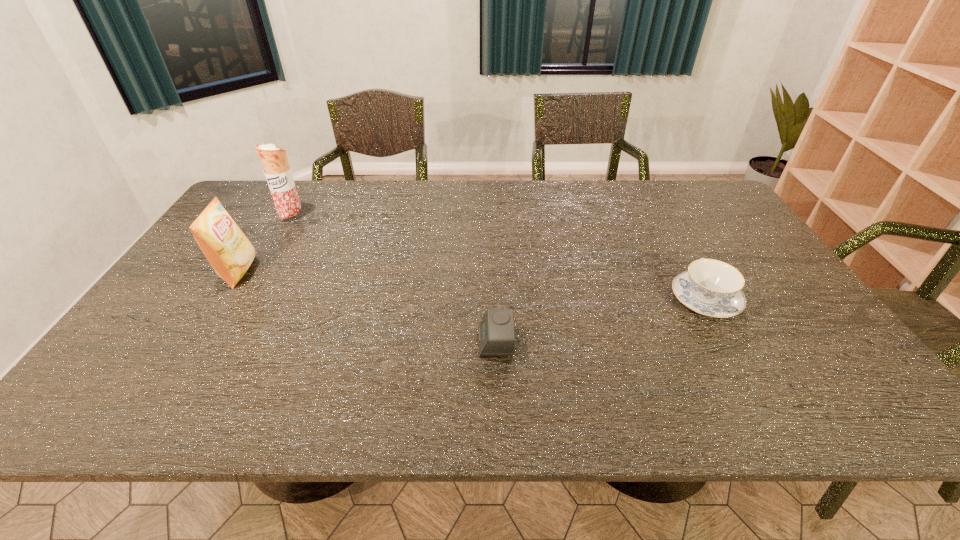
Locate an element on the screen. free space between the nearest object and the third shortest object is located at coordinates (367, 307).

At what (x,y) coordinates should I click in order to perform the action: click on vacant space that is in between the shortest object and the third shortest object. Please return your answer as a coordinate pair (x, y). The image size is (960, 540). Looking at the image, I should click on (367, 307).

Find the location of `vacant space in between the rightmost object and the second tallest object`. vacant space in between the rightmost object and the second tallest object is located at coordinates (x=471, y=286).

Select which object appears as the third closest to the burrito. Please provide its 2D coordinates. Your answer should be formatted as a tuple, i.e. [(x, y)], where the tuple contains the x and y coordinates of a point satisfying the conditions above.

[(710, 287)]

Find the location of a particular element. The width and height of the screenshot is (960, 540). object that is the closest to the second object from right to left is located at coordinates (710, 287).

Image resolution: width=960 pixels, height=540 pixels. What are the coordinates of `free space that satisfies the following two spatial constraints: 1. on the front-facing side of the crisp (potato chip); 2. with the handle on the side of the chinaware` in the screenshot? It's located at (222, 299).

You are a GUI agent. You are given a task and a screenshot of the screen. Output one action in this format:
    pyautogui.click(x=<x>, y=<y>)
    Task: Click on the vacant space that satisfies the following two spatial constraints: 1. on the front-facing side of the crisp (potato chip); 2. with the handle on the side of the rightmost object
    The height and width of the screenshot is (540, 960).
    Given the screenshot: What is the action you would take?
    pyautogui.click(x=222, y=299)

You are a GUI agent. You are given a task and a screenshot of the screen. Output one action in this format:
    pyautogui.click(x=<x>, y=<y>)
    Task: Click on the vacant point that satisfies the following two spatial constraints: 1. with the handle on the side of the chinaware; 2. on the front-facing side of the crisp (potato chip)
    
    Given the screenshot: What is the action you would take?
    pyautogui.click(x=689, y=272)

You are a GUI agent. You are given a task and a screenshot of the screen. Output one action in this format:
    pyautogui.click(x=<x>, y=<y>)
    Task: Click on the free space that satisfies the following two spatial constraints: 1. on the front-facing side of the crisp (potato chip); 2. with the handle on the side of the rightmost object
    The height and width of the screenshot is (540, 960).
    Given the screenshot: What is the action you would take?
    [222, 299]

This screenshot has width=960, height=540. Identify the location of vacant space that satisfies the following two spatial constraints: 1. with the handle on the side of the second shortest object; 2. on the front-facing side of the second tallest object. (689, 272).